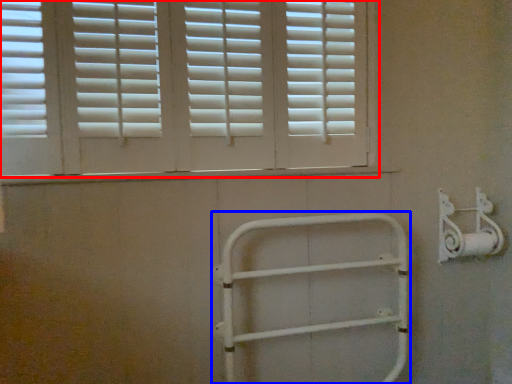
Question: Which object is further to the camera taking this photo, window (highlighted by a red box) or rail (highlighted by a blue box)?

Choices:
 (A) window
 (B) rail

Answer: (B)